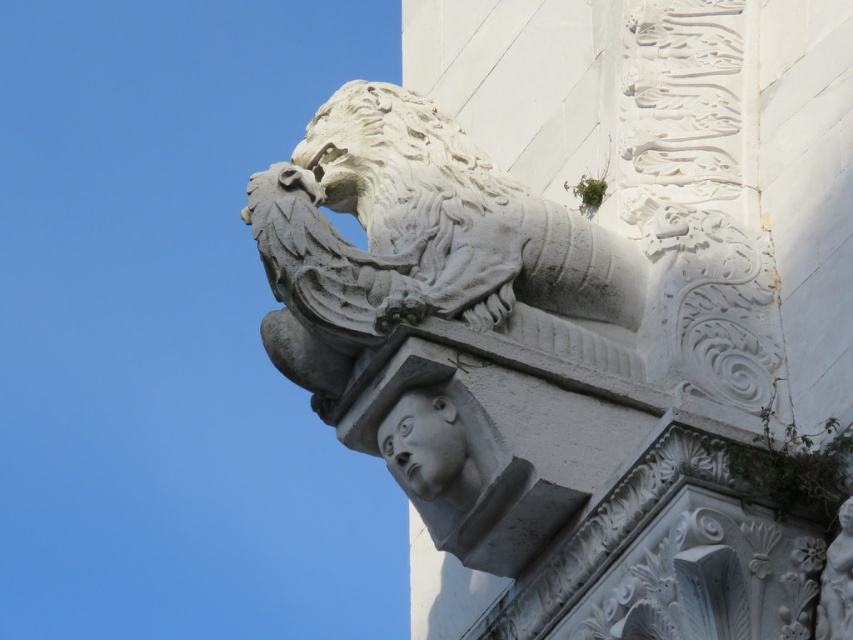
Question: Which object appears closest to the camera in this image?

Choices:
 (A) gray stone head at center
 (B) white stone lion at upper center

Answer: (A)

Question: Does white stone lion at upper center have a greater width compared to gray stone head at center?

Choices:
 (A) yes
 (B) no

Answer: (A)

Question: Can you confirm if white stone lion at upper center is positioned to the right of gray stone head at center?

Choices:
 (A) no
 (B) yes

Answer: (A)

Question: Which point appears closest to the camera in this image?

Choices:
 (A) (404, 93)
 (B) (415, 481)

Answer: (B)

Question: Is white stone lion at upper center to the left of gray stone head at center from the viewer's perspective?

Choices:
 (A) yes
 (B) no

Answer: (A)